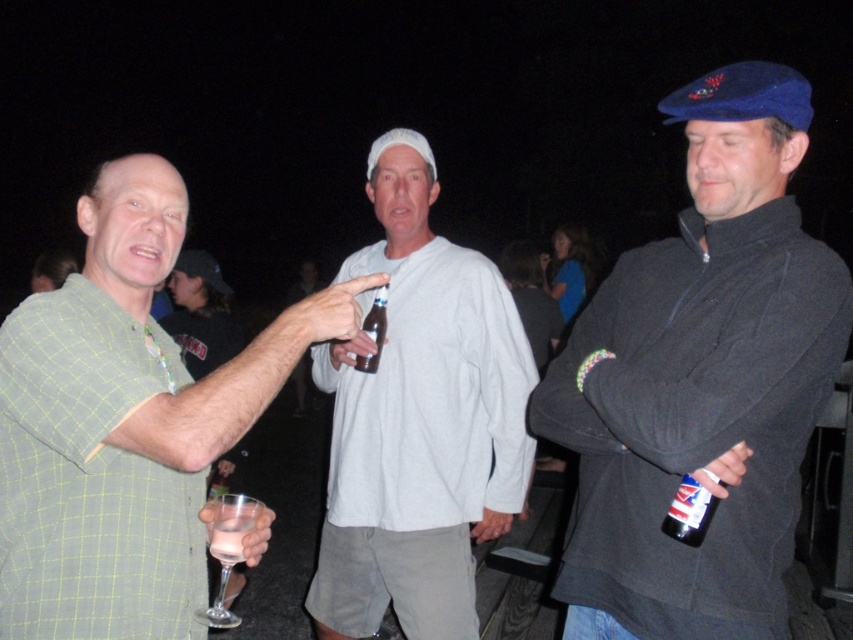
Question: Does clear glass wine glass at lower left have a larger size compared to clear plastic cup at lower left?

Choices:
 (A) no
 (B) yes

Answer: (B)

Question: Among these points, which one is nearest to the camera?

Choices:
 (A) (695, 486)
 (B) (608, 381)
 (C) (386, 330)

Answer: (A)

Question: Estimate the real-world distances between objects in this image. Which object is farther from the clear glass wine glass at lower left?

Choices:
 (A) white matte shirt at center
 (B) clear glass bottle at center

Answer: (A)

Question: Where is green checkered shirt at left located in relation to clear glass bottle at center in the image?

Choices:
 (A) below
 (B) above

Answer: (A)

Question: Which point is farther from the camera taking this photo?

Choices:
 (A) (379, 289)
 (B) (374, 244)
 (C) (714, 497)

Answer: (B)

Question: Is green checkered shirt at left further to the viewer compared to clear glass wine glass at lower left?

Choices:
 (A) yes
 (B) no

Answer: (B)